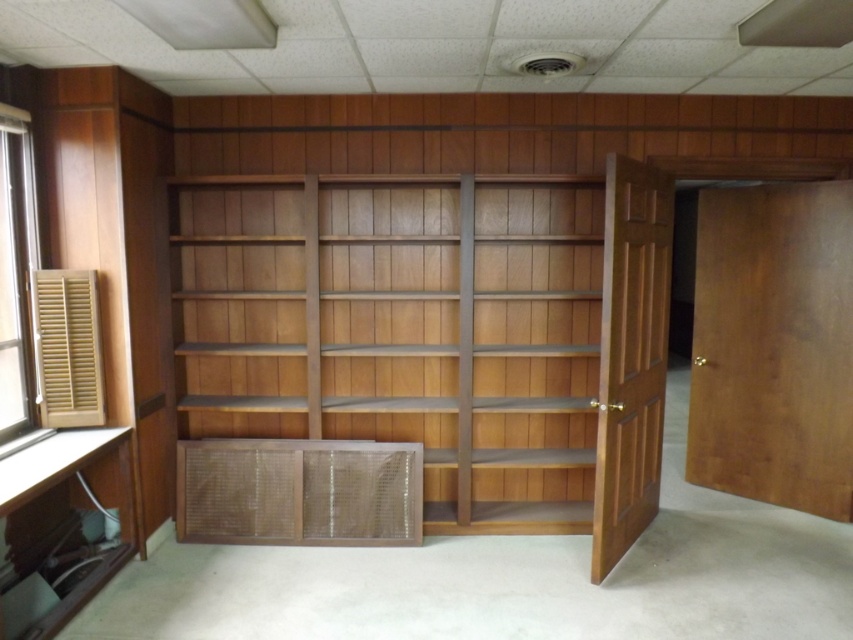
Question: Which of the following is the closest to the observer?

Choices:
 (A) shiny brown wood bookshelf at center
 (B) wooden slatted window at left

Answer: (B)

Question: Is shiny brown wood bookshelf at center thinner than wooden slatted window at left?

Choices:
 (A) yes
 (B) no

Answer: (B)

Question: Which object is farther from the camera taking this photo?

Choices:
 (A) wooden slatted window at left
 (B) shiny brown wood bookshelf at center

Answer: (B)

Question: Can you confirm if shiny brown wood bookshelf at center is smaller than wooden slatted window at left?

Choices:
 (A) yes
 (B) no

Answer: (B)

Question: Is shiny brown wood bookshelf at center closer to camera compared to wooden slatted window at left?

Choices:
 (A) yes
 (B) no

Answer: (B)